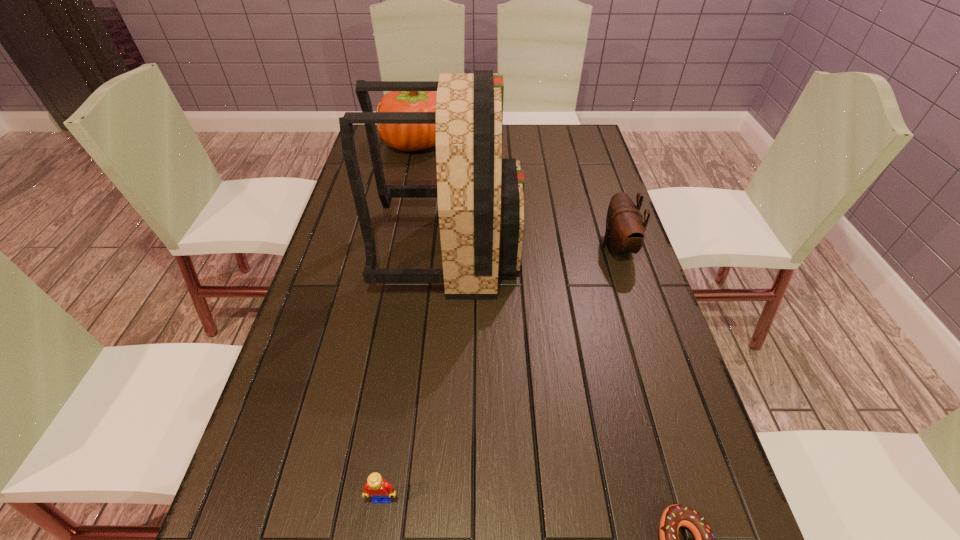
The width and height of the screenshot is (960, 540). Find the location of `free spot located with the flap open on the third shortest object`. free spot located with the flap open on the third shortest object is located at coordinates (486, 247).

Locate an element on the screen. Image resolution: width=960 pixels, height=540 pixels. object at the far edge is located at coordinates (406, 137).

The width and height of the screenshot is (960, 540). Find the location of `backpack present at the left edge`. backpack present at the left edge is located at coordinates (480, 195).

Find the location of a particular element. pumpkin that is at the left edge is located at coordinates (406, 137).

I want to click on object at the right edge, so click(x=625, y=230).

Find the location of a particular element. The width and height of the screenshot is (960, 540). object present at the far left corner is located at coordinates (406, 137).

Find the location of a particular element. This screenshot has height=540, width=960. vacant space at the far edge is located at coordinates (549, 156).

In the image, there is a desktop. Where is `vacant area at the left edge`? This screenshot has width=960, height=540. vacant area at the left edge is located at coordinates (281, 373).

Find the location of `vacant region at the right edge of the desktop`. vacant region at the right edge of the desktop is located at coordinates (586, 251).

In the image, there is a desktop. Where is `vacant space at the far left corner`? This screenshot has width=960, height=540. vacant space at the far left corner is located at coordinates (385, 150).